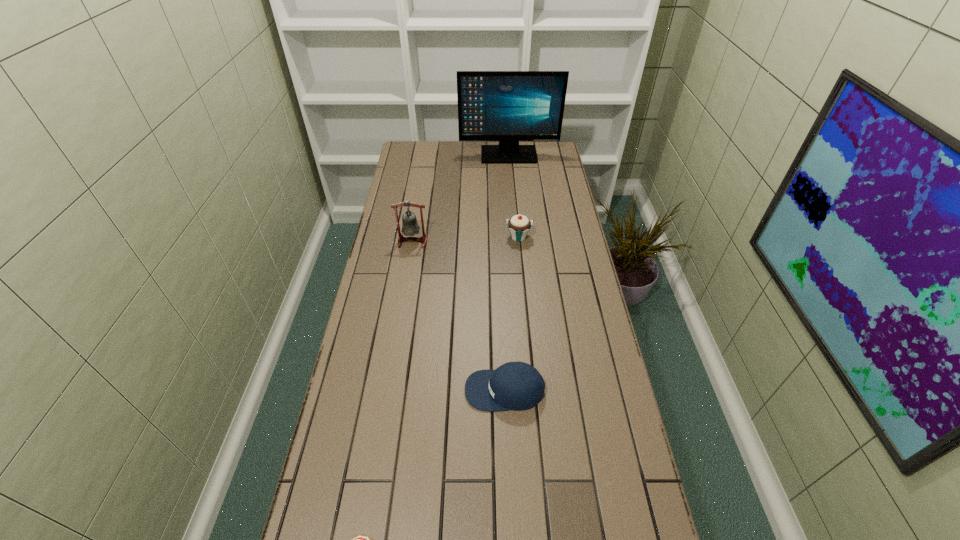
The height and width of the screenshot is (540, 960). What are the coordinates of `vacant space that's between the fourth shortest object and the monitor` in the screenshot? It's located at (461, 198).

At what (x,y) coordinates should I click in order to perform the action: click on blank region between the right cupcake and the monitor. Please return your answer as a coordinate pair (x, y). Image resolution: width=960 pixels, height=540 pixels. Looking at the image, I should click on click(x=514, y=196).

What are the coordinates of `free spot between the second nearest object and the right cupcake` in the screenshot? It's located at (512, 314).

Where is `blank region between the right cupcake and the fourth farthest object`? blank region between the right cupcake and the fourth farthest object is located at coordinates (512, 314).

Identify the location of vacant space that's between the farthest object and the right cupcake. This screenshot has height=540, width=960. (514, 196).

Identify which object is the fourth closest to the baseball cap. Please provide its 2D coordinates. Your answer should be formatted as a tuple, i.e. [(x, y)], where the tuple contains the x and y coordinates of a point satisfying the conditions above.

[(507, 106)]

Locate which object is the third closest to the left cupcake. Please provide its 2D coordinates. Your answer should be formatted as a tuple, i.e. [(x, y)], where the tuple contains the x and y coordinates of a point satisfying the conditions above.

[(519, 225)]

Image resolution: width=960 pixels, height=540 pixels. I want to click on free spot that satisfies the following two spatial constraints: 1. on the screen side of the farther cupcake; 2. on the left side of the monitor, so [x=516, y=237].

The image size is (960, 540). Identify the location of free location that satisfies the following two spatial constraints: 1. on the screen side of the tallest object; 2. on the front-facing side of the baseball cap. (530, 390).

Find the location of a particular element. The width and height of the screenshot is (960, 540). vacant space that satisfies the following two spatial constraints: 1. on the screen side of the farther cupcake; 2. on the right side of the farthest object is located at coordinates tap(516, 237).